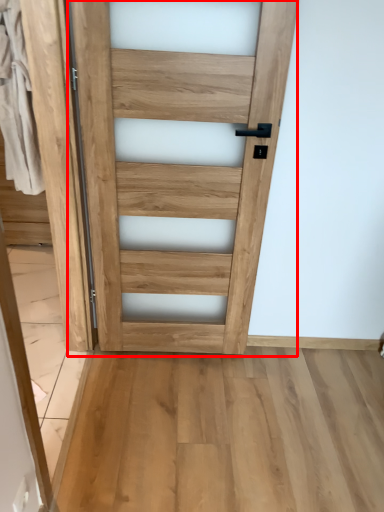
Question: From the image's perspective, what is the correct spatial relationship of door (annotated by the red box) in relation to barn door?

Choices:
 (A) above
 (B) below

Answer: (A)